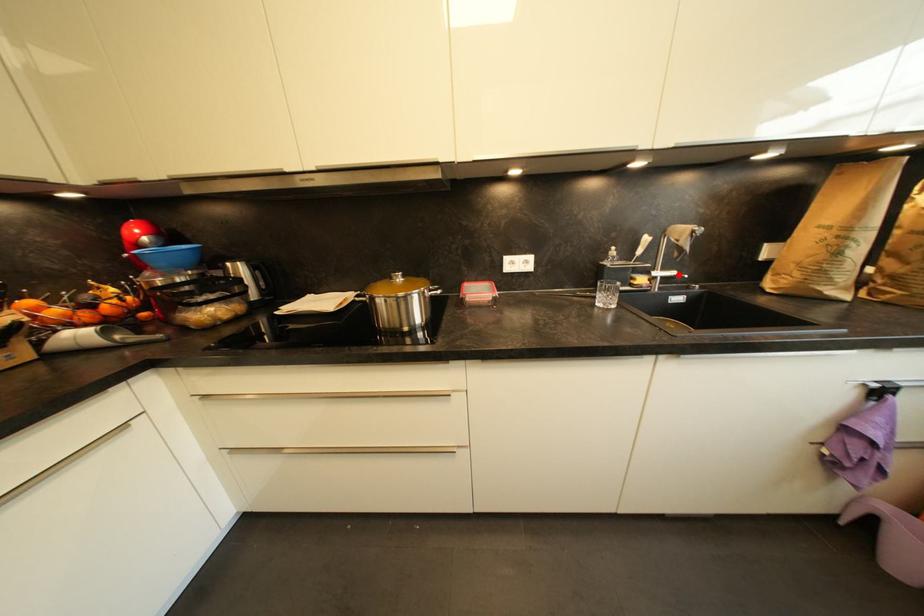
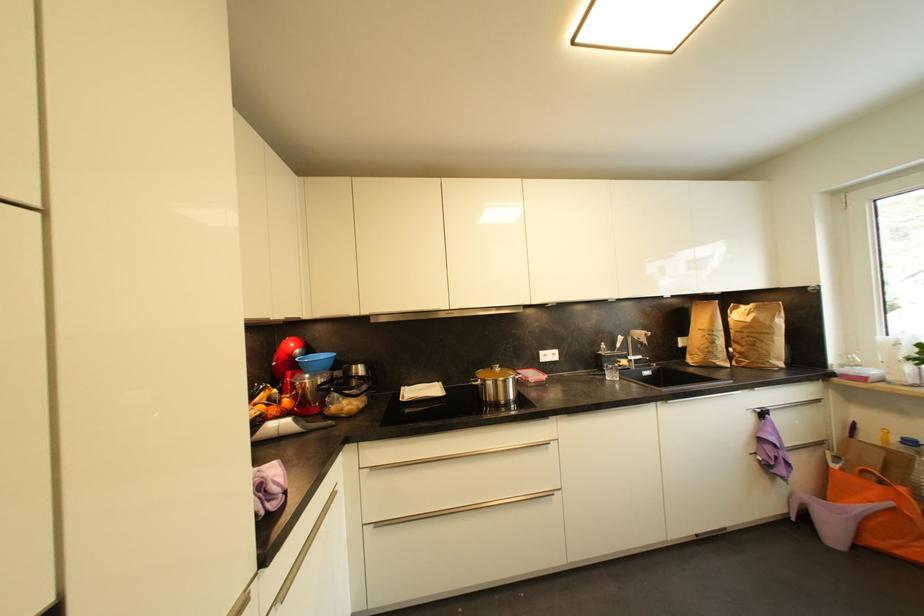
Question: I am providing you with two images of the same scene from different viewpoints. Image1 has a red point marked. In image2, the corresponding 3D location appears at what relative position? Reply with the corresponding letter.

Choices:
 (A) Closer
 (B) Farther

Answer: (B)